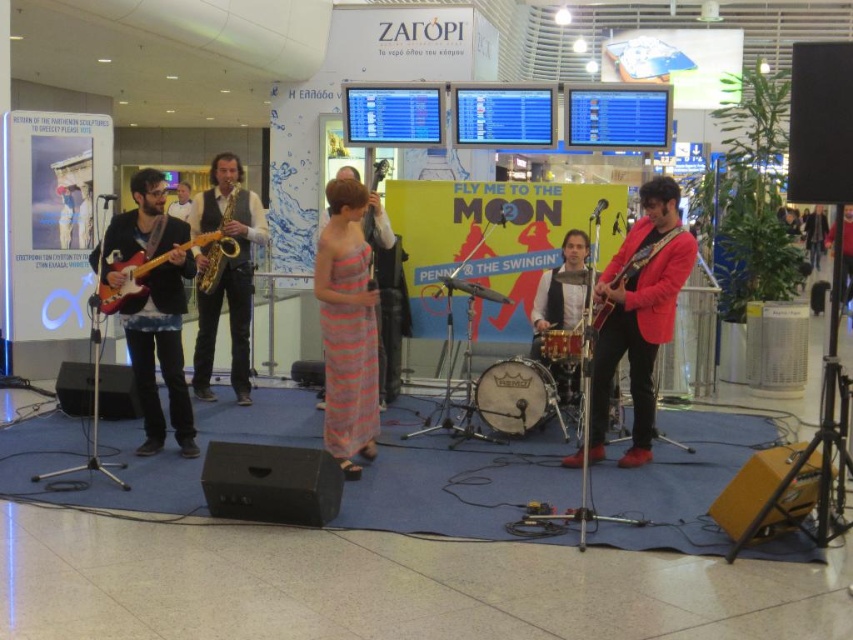
Which is above, matte black guitar at left or pink striped dress at center?

matte black guitar at left

Does matte black guitar at left appear on the right side of pink striped dress at center?

In fact, matte black guitar at left is to the left of pink striped dress at center.

Which is in front, point (186, 250) or point (350, 436)?

Point (350, 436) is in front.

Find the location of a particular element. The width and height of the screenshot is (853, 640). matte black guitar at left is located at coordinates point(154,307).

Does matte wood electric guitar at left appear on the right side of shiny red guitar at center?

No, matte wood electric guitar at left is not to the right of shiny red guitar at center.

Between matte wood electric guitar at left and shiny red guitar at center, which one appears on the right side from the viewer's perspective?

Positioned to the right is shiny red guitar at center.

The image size is (853, 640). Find the location of `matte wood electric guitar at left`. matte wood electric guitar at left is located at coordinates (152, 268).

Identify the location of matte wood electric guitar at left. This screenshot has height=640, width=853. (152, 268).

Between point (247, 234) and point (107, 284), which one is positioned in front?

Point (107, 284)

Does gold shiny saxophone at left appear on the left side of matte wood electric guitar at left?

Correct, you'll find gold shiny saxophone at left to the left of matte wood electric guitar at left.

Measure the distance between point (x=198, y=332) and camera.

Point (x=198, y=332) and camera are 6.90 meters apart.

Where is `gold shiny saxophone at left`? This screenshot has height=640, width=853. gold shiny saxophone at left is located at coordinates (225, 275).